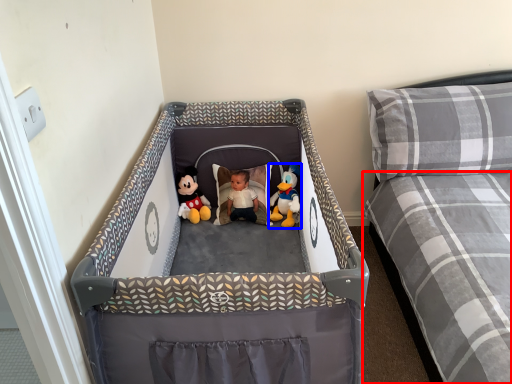
Question: Which object is closer to the camera taking this photo, mattress (highlighted by a red box) or toy (highlighted by a blue box)?

Choices:
 (A) mattress
 (B) toy

Answer: (A)